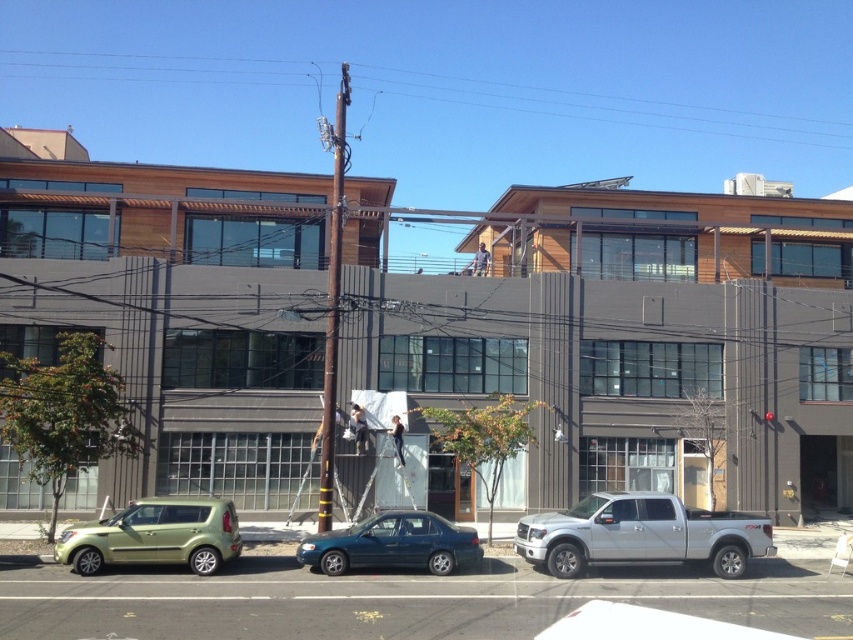
Question: Which object is the farthest from the teal glossy sedan at center?

Choices:
 (A) metallic green hatchback at lower left
 (B) silver metallic truck at lower right

Answer: (B)

Question: Does metallic pole at upper center have a smaller size compared to silver metallic truck at lower right?

Choices:
 (A) no
 (B) yes

Answer: (A)

Question: Observing the image, what is the correct spatial positioning of metallic green hatchback at lower left in reference to teal glossy sedan at center?

Choices:
 (A) below
 (B) above

Answer: (B)

Question: Among these points, which one is farthest from the camera?

Choices:
 (A) (344, 540)
 (B) (138, 547)

Answer: (A)

Question: Which object is farther from the camera taking this photo?

Choices:
 (A) silver metallic truck at lower right
 (B) metallic green hatchback at lower left

Answer: (A)

Question: Is silver metallic truck at lower right to the left of teal glossy sedan at center from the viewer's perspective?

Choices:
 (A) no
 (B) yes

Answer: (A)